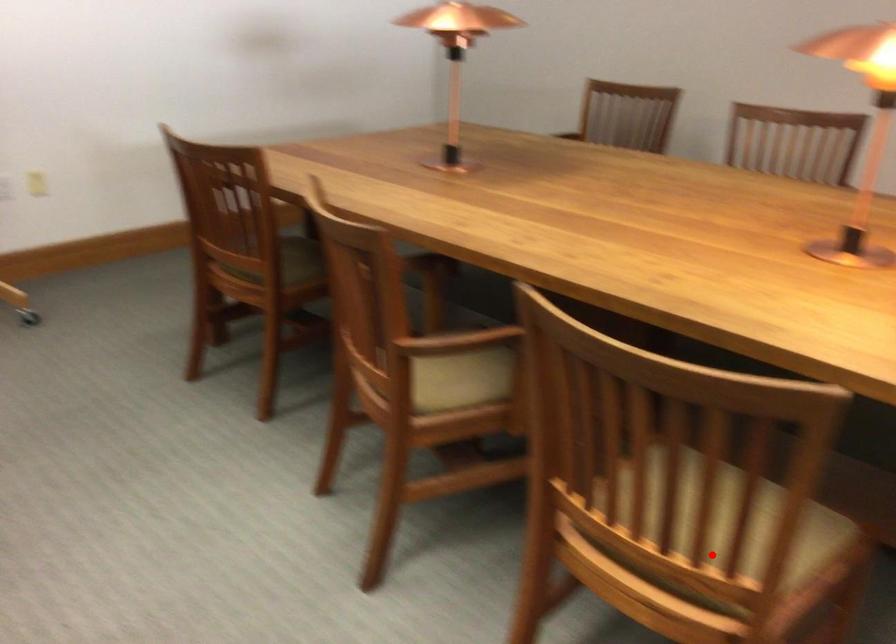
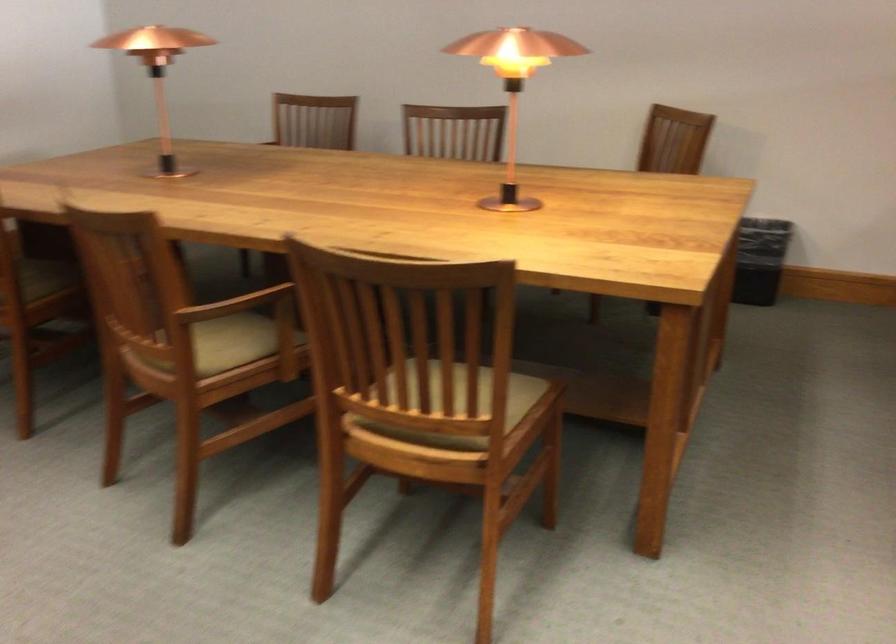
The point at the highlighted location is marked in the first image. Where is the corresponding point in the second image?

(460, 404)